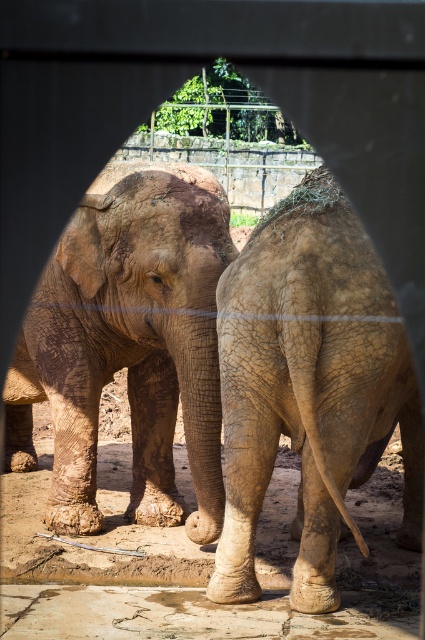
Which of these two, muddy textured elephant at center or brown textured skin at center, stands taller?

With more height is muddy textured elephant at center.

Which is in front, point (142, 404) or point (373, 326)?

Point (373, 326) is more forward.

This screenshot has height=640, width=425. I want to click on muddy textured elephant at center, so click(127, 344).

Find the location of `muddy textured elephant at center`. muddy textured elephant at center is located at coordinates (127, 344).